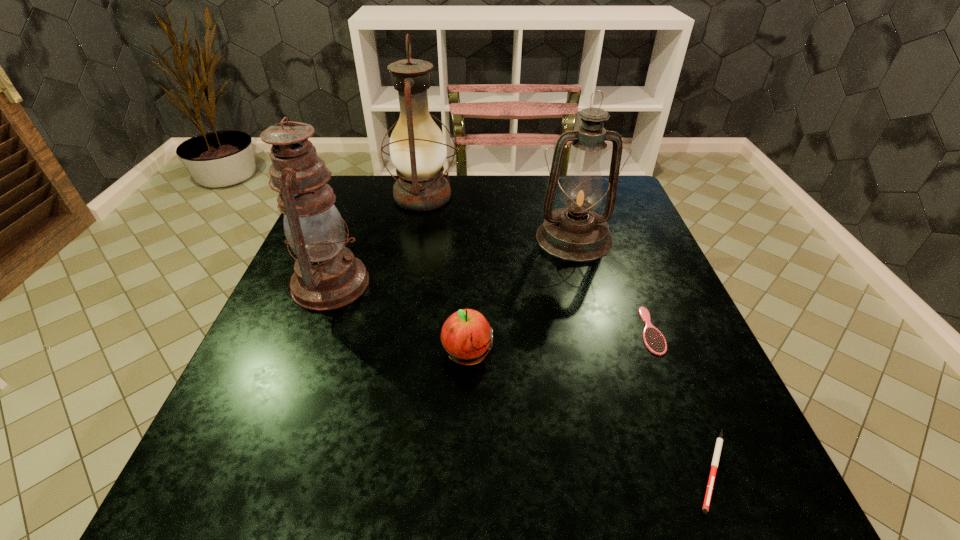
The image size is (960, 540). Find the location of `the rightmost oil lamp`. the rightmost oil lamp is located at coordinates (576, 233).

What are the coordinates of `apple` in the screenshot? It's located at (466, 337).

Where is `hairbrush`? hairbrush is located at coordinates (654, 340).

At what (x,y) coordinates should I click in order to perform the action: click on the nearest object. Please return your answer as a coordinate pair (x, y). The image size is (960, 540). Looking at the image, I should click on (719, 442).

Find the location of `pen`. pen is located at coordinates (719, 442).

Where is `free spot located 0.050m on the left of the rightmost oil lamp`? This screenshot has width=960, height=540. free spot located 0.050m on the left of the rightmost oil lamp is located at coordinates (516, 238).

The height and width of the screenshot is (540, 960). What are the coordinates of `vacant point located 0.050m on the right of the third shortest object` in the screenshot? It's located at (519, 355).

Identify the location of vacant space positioned on the back of the hairbrush. Image resolution: width=960 pixels, height=540 pixels. (615, 242).

At what (x,y) coordinates should I click in order to perform the action: click on object at the near edge. Please return your answer as a coordinate pair (x, y). The image size is (960, 540). Looking at the image, I should click on [719, 442].

The image size is (960, 540). What are the coordinates of `oil lamp that is positioned at the right edge` in the screenshot? It's located at (576, 233).